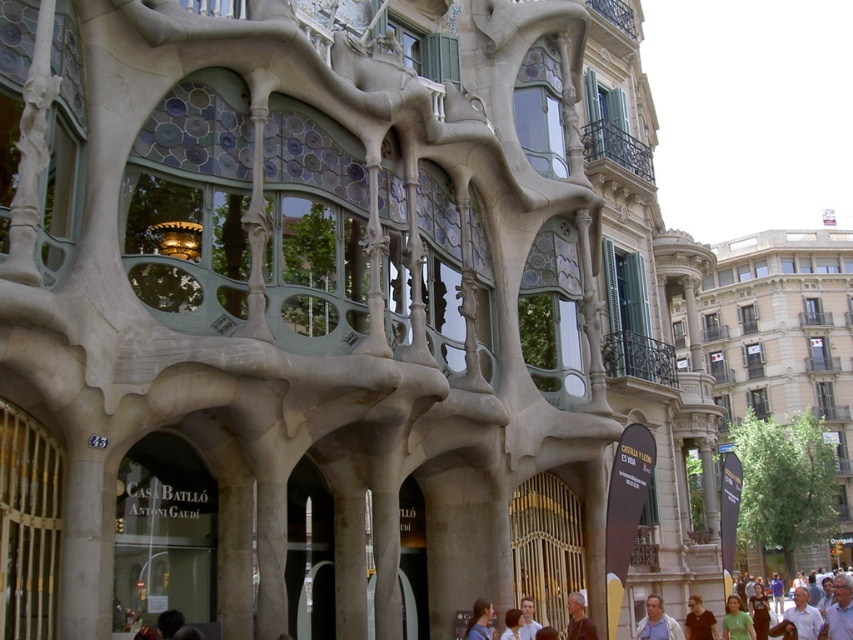
Question: Can you confirm if light brown hair at lower right is positioned below gray hair at lower center?

Choices:
 (A) yes
 (B) no

Answer: (A)

Question: Does light brown shirt at lower right have a smaller size compared to light brown hair at lower right?

Choices:
 (A) yes
 (B) no

Answer: (B)

Question: Which point appears closest to the camera in this image?

Choices:
 (A) (679, 627)
 (B) (474, 602)

Answer: (B)

Question: Among these points, which one is farthest from the camera?

Choices:
 (A) (689, 621)
 (B) (511, 612)

Answer: (A)

Question: Does light brown shirt at lower right have a greater width compared to gray hair at lower center?

Choices:
 (A) yes
 (B) no

Answer: (A)

Question: Among these objects, which one is farthest from the camera?

Choices:
 (A) smooth brown hair at center
 (B) green matte shirt at lower right

Answer: (B)